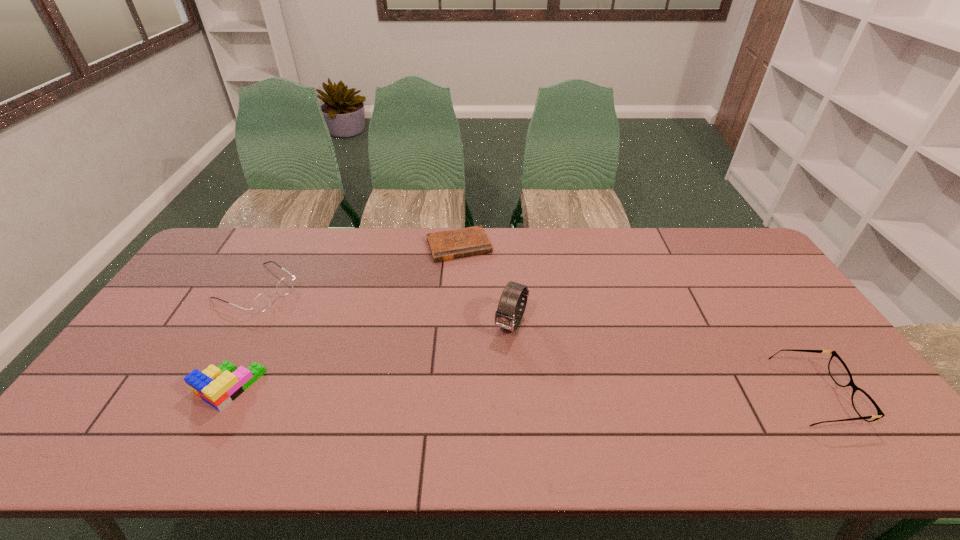
I want to click on vacant region between the rightmost object and the farthest object, so coord(636,321).

Identify the location of free space between the Lego and the watch. (370, 355).

The height and width of the screenshot is (540, 960). In order to click on vacant area that lies between the farther spectacles and the Lego in this screenshot , I will do `click(243, 339)`.

Locate an element on the screen. This screenshot has width=960, height=540. free spot between the right spectacles and the Lego is located at coordinates (521, 392).

Identify the location of vacant space in between the Lego and the rightmost object. The width and height of the screenshot is (960, 540). (521, 392).

Locate an element on the screen. free area in between the Lego and the farther spectacles is located at coordinates (243, 339).

Image resolution: width=960 pixels, height=540 pixels. Find the location of `free space between the farther spectacles and the tallest object`. free space between the farther spectacles and the tallest object is located at coordinates (384, 307).

The image size is (960, 540). Find the location of `vacant point located between the shortest object and the right spectacles`. vacant point located between the shortest object and the right spectacles is located at coordinates (636, 321).

The image size is (960, 540). In order to click on vacant area that lies between the shortest object and the Lego in this screenshot , I will do `click(344, 316)`.

Choose which object is the third nearest neighbor to the Lego. Please provide its 2D coordinates. Your answer should be formatted as a tuple, i.e. [(x, y)], where the tuple contains the x and y coordinates of a point satisfying the conditions above.

[(510, 303)]